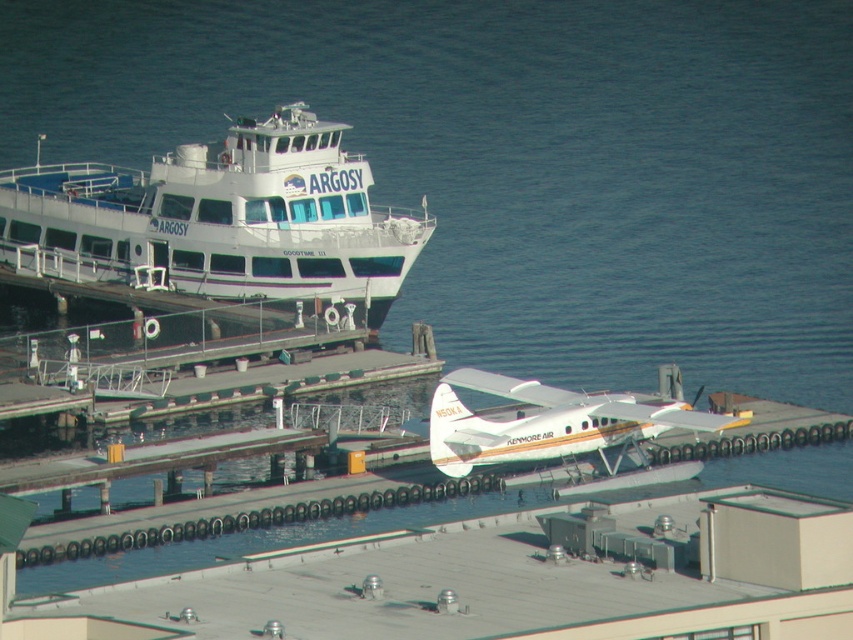
You are a tourist standing on the pier and want to take a photo of both the white glossy ferry boat at upper left and the white matte seaplane at center. Which object should you position yourself closer to in order to capture both in the same frame?

You should position yourself closer to the white glossy ferry boat at upper left because it is to the left of the white matte seaplane at center, allowing both to be captured in the same frame when centered on the ferry.

You are planning to take a photo of the white glossy ferry boat at upper left and the white matte seaplane at center. Which one should you zoom in more on to capture their full width in the frame?

You should zoom in more on the white matte seaplane at center because the white glossy ferry boat at upper left is wider than the white matte seaplane at center. Since the ferry is wider, you need to zoom out less to include its full width, while the seaplane being narrower requires a closer zoom to fit entirely in the frame.